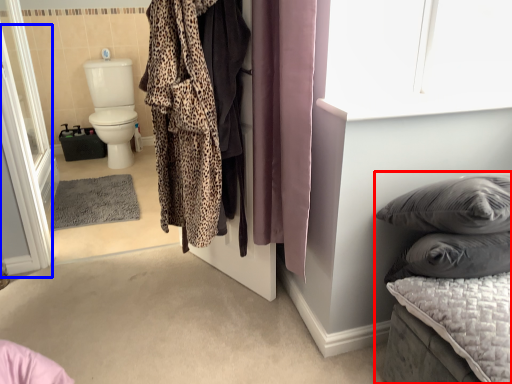
Question: Which object is further to the camera taking this photo, furniture (highlighted by a red box) or screen door (highlighted by a blue box)?

Choices:
 (A) furniture
 (B) screen door

Answer: (B)